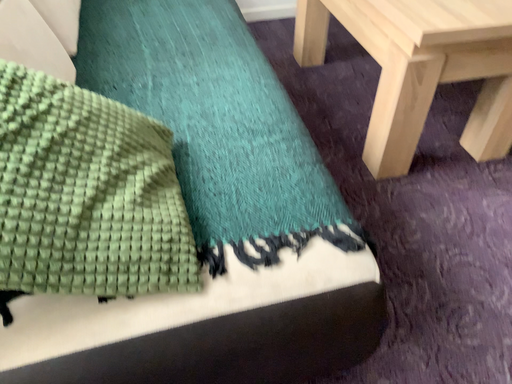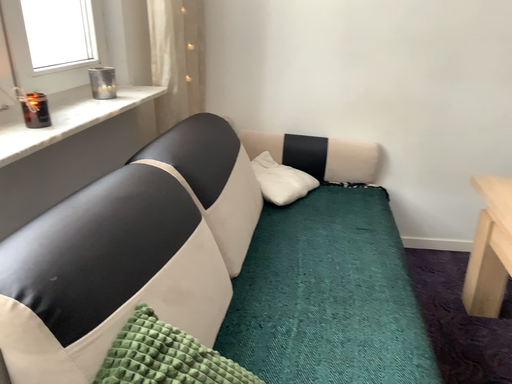
Question: Which way did the camera rotate in the video?

Choices:
 (A) rotated left
 (B) rotated right

Answer: (A)